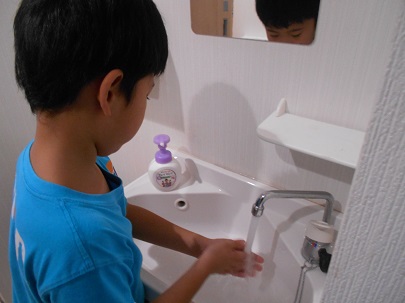
In order to click on mirror in this screenshot , I will do `click(248, 32)`.